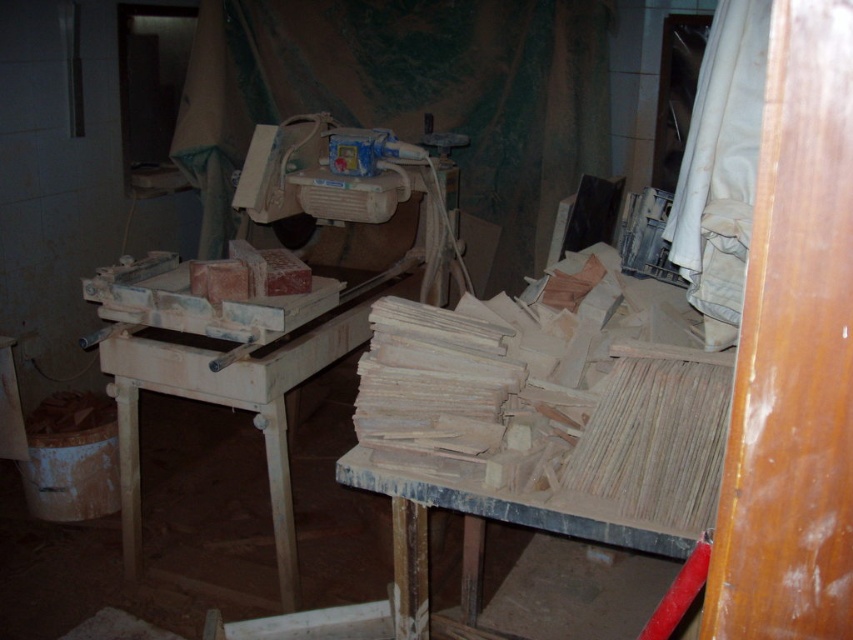
Question: Which point appears farthest from the camera in this image?

Choices:
 (A) (663, 541)
 (B) (297, 320)

Answer: (B)

Question: Can you confirm if wooden table at center is wider than wooden at center?

Choices:
 (A) no
 (B) yes

Answer: (B)

Question: Does wooden table at center appear on the left side of wooden at center?

Choices:
 (A) yes
 (B) no

Answer: (A)

Question: Among these points, which one is farthest from the camera?

Choices:
 (A) click(409, 579)
 (B) click(148, 353)

Answer: (B)

Question: Where is wooden table at center located in relation to wooden at center in the image?

Choices:
 (A) below
 (B) above

Answer: (B)